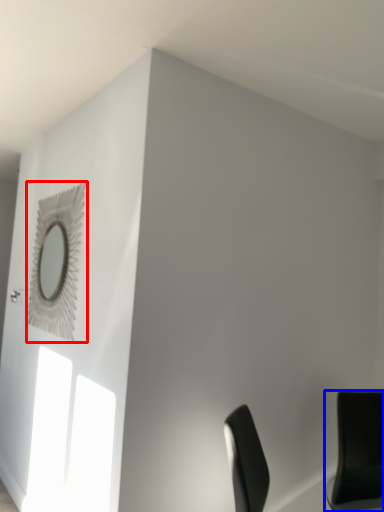
Question: Which object appears closest to the camera in this image, mirror (highlighted by a red box) or chair (highlighted by a blue box)?

Choices:
 (A) mirror
 (B) chair

Answer: (B)